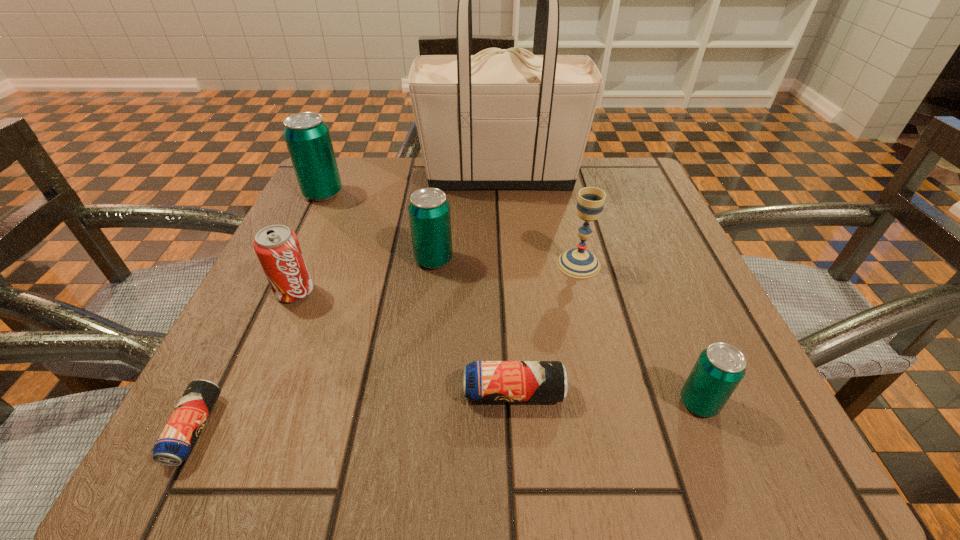
Where is `vacant space that's between the gray shopping bag and the second shortest beer can`? vacant space that's between the gray shopping bag and the second shortest beer can is located at coordinates (507, 284).

The height and width of the screenshot is (540, 960). What are the coordinates of `free space between the bigger blue beer can and the rightmost beer can` in the screenshot? It's located at (607, 398).

Find the location of `object that can be found as the fifth closest to the gray chalice`. object that can be found as the fifth closest to the gray chalice is located at coordinates (277, 247).

Identify which object is the fourth nearest to the gray shopping bag. Please provide its 2D coordinates. Your answer should be formatted as a tuple, i.e. [(x, y)], where the tuple contains the x and y coordinates of a point satisfying the conditions above.

[(277, 247)]

Locate which beer can is the fourth closest to the pink soda can. Please provide its 2D coordinates. Your answer should be formatted as a tuple, i.e. [(x, y)], where the tuple contains the x and y coordinates of a point satisfying the conditions above.

[(484, 381)]

Identify which beer can is the nearest to the biggest teal beer can. Please provide its 2D coordinates. Your answer should be formatted as a tuple, i.e. [(x, y)], where the tuple contains the x and y coordinates of a point satisfying the conditions above.

[(429, 211)]

Identify which teal beer can is located as the nearest to the third beer can from right to left. Please provide its 2D coordinates. Your answer should be formatted as a tuple, i.e. [(x, y)], where the tuple contains the x and y coordinates of a point satisfying the conditions above.

[(307, 137)]

The image size is (960, 540). I want to click on teal beer can that is the second closest to the gray shopping bag, so click(x=429, y=211).

Image resolution: width=960 pixels, height=540 pixels. Find the location of `vacant space that satisfies the following two spatial constraints: 1. with handles facing forward on the gray shopping bag; 2. on the back side of the gray chalice`. vacant space that satisfies the following two spatial constraints: 1. with handles facing forward on the gray shopping bag; 2. on the back side of the gray chalice is located at coordinates (506, 264).

Locate an element on the screen. The image size is (960, 540). vacant region that satisfies the following two spatial constraints: 1. with handles facing forward on the shopping bag; 2. on the front side of the fourth beer can from left to right is located at coordinates (515, 393).